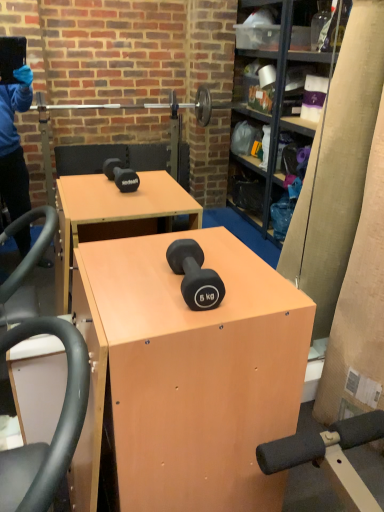
At what (x,y) coordinates should I click in order to perform the action: click on empty space that is to the right of matte black dumbbell at center. Please return your answer as a coordinate pair (x, y). This screenshot has height=512, width=384. Looking at the image, I should click on (256, 288).